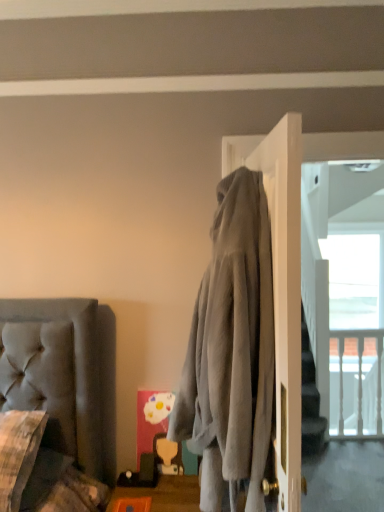
Question: Can you confirm if plush gray couch at lower left is wider than gray fabric screen door at upper right?

Choices:
 (A) no
 (B) yes

Answer: (B)

Question: Considering the relative positions of plush gray couch at lower left and gray fabric screen door at upper right in the image provided, is plush gray couch at lower left to the left of gray fabric screen door at upper right from the viewer's perspective?

Choices:
 (A) yes
 (B) no

Answer: (A)

Question: Considering the relative sizes of plush gray couch at lower left and gray fabric screen door at upper right in the image provided, is plush gray couch at lower left smaller than gray fabric screen door at upper right?

Choices:
 (A) yes
 (B) no

Answer: (A)

Question: Can we say plush gray couch at lower left lies outside gray fabric screen door at upper right?

Choices:
 (A) yes
 (B) no

Answer: (A)

Question: From the image's perspective, is plush gray couch at lower left under gray fabric screen door at upper right?

Choices:
 (A) yes
 (B) no

Answer: (A)

Question: Considering the positions of gray fabric screen door at upper right and plush gray couch at lower left in the image, is gray fabric screen door at upper right wider or thinner than plush gray couch at lower left?

Choices:
 (A) thin
 (B) wide

Answer: (A)

Question: From the image's perspective, is gray fabric screen door at upper right positioned above or below plush gray couch at lower left?

Choices:
 (A) above
 (B) below

Answer: (A)

Question: Does point (359, 476) appear closer or farther from the camera than point (36, 473)?

Choices:
 (A) closer
 (B) farther

Answer: (B)

Question: Do you think gray fabric screen door at upper right is within plush gray couch at lower left, or outside of it?

Choices:
 (A) inside
 (B) outside

Answer: (B)

Question: In the image, is orange plastic tray at lower center on the left side or the right side of plush gray couch at lower left?

Choices:
 (A) left
 (B) right

Answer: (B)

Question: Considering their positions, is orange plastic tray at lower center located in front of or behind plush gray couch at lower left?

Choices:
 (A) front
 (B) behind

Answer: (B)

Question: In terms of height, does orange plastic tray at lower center look taller or shorter compared to plush gray couch at lower left?

Choices:
 (A) tall
 (B) short

Answer: (A)

Question: From a real-world perspective, relative to plush gray couch at lower left, is orange plastic tray at lower center vertically above or below?

Choices:
 (A) below
 (B) above

Answer: (A)

Question: From the image's perspective, is orange plastic tray at lower center positioned above or below clear glass window at upper right?

Choices:
 (A) above
 (B) below

Answer: (B)

Question: Considering the positions of orange plastic tray at lower center and clear glass window at upper right in the image, is orange plastic tray at lower center taller or shorter than clear glass window at upper right?

Choices:
 (A) short
 (B) tall

Answer: (A)